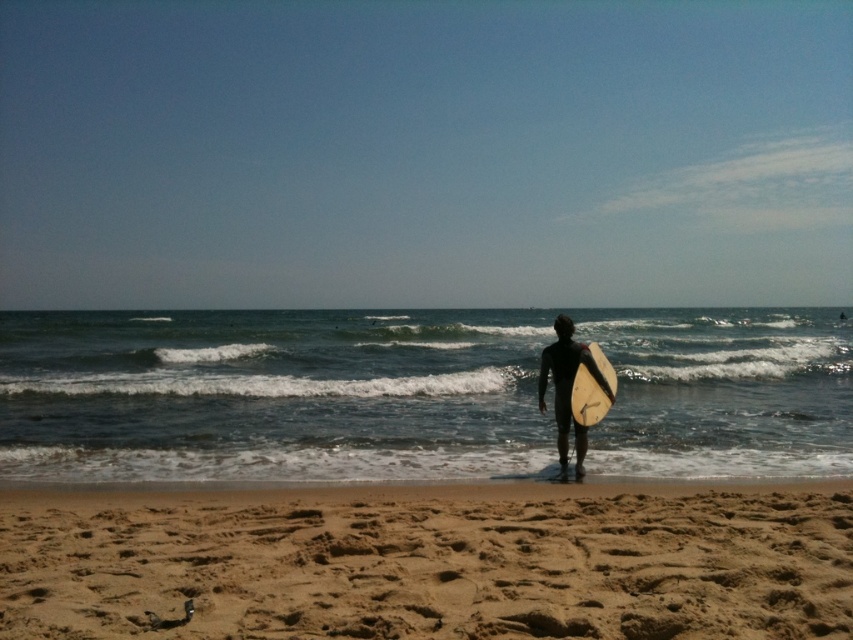
You are standing on the beach and want to place a 2.5 meter long flagpole at point (515,349). Considering the distance from your current position to that point, will the flagpole fit entirely within the visible beach area without going into the water?

The point (515,349) is 38.13 meters away from the viewer. Since the flagpole is only 2.5 meters long, it will fit entirely within the visible beach area as long as the placement does not extend towards the water. The distance is sufficient to accommodate the flagpole without issues.